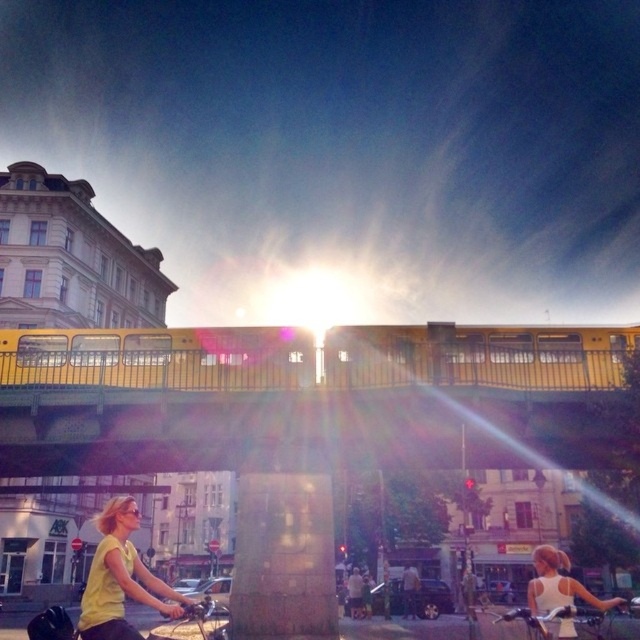
What do you see at coordinates (284, 557) in the screenshot? The height and width of the screenshot is (640, 640). I see `satin gold pillar at center` at bounding box center [284, 557].

Consider the image. Is satin gold pillar at center positioned behind matte yellow bicycle at lower left?

Yes, satin gold pillar at center is further from the viewer.

Does point (301, 500) lie behind point (74, 625)?

Yes, point (301, 500) is behind point (74, 625).

In order to click on satin gold pillar at center in this screenshot , I will do (x=284, y=557).

Does matte yellow bicycle at lower left appear under white matte tank top at center?

Yes.

Can you confirm if matte yellow bicycle at lower left is thinner than white matte tank top at center?

No.

Image resolution: width=640 pixels, height=640 pixels. What do you see at coordinates (196, 621) in the screenshot?
I see `matte yellow bicycle at lower left` at bounding box center [196, 621].

This screenshot has height=640, width=640. What are the coordinates of `matte yellow bicycle at lower left` in the screenshot? It's located at (196, 621).

Does satin gold pillar at center appear over yellow matte shirt at lower left?

Correct, satin gold pillar at center is located above yellow matte shirt at lower left.

Does satin gold pillar at center have a greater height compared to yellow matte shirt at lower left?

No, satin gold pillar at center is not taller than yellow matte shirt at lower left.

Who is more forward, (x=282, y=534) or (x=164, y=596)?

Point (x=164, y=596) is in front.

I want to click on satin gold pillar at center, so click(284, 557).